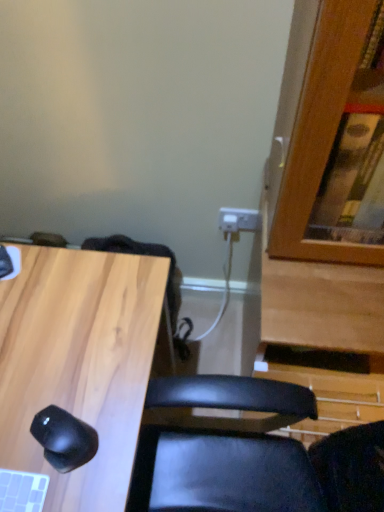
Find the location of a particular element. light wood/black mouse at lower left is located at coordinates (85, 369).

What do you see at coordinates (85, 369) in the screenshot?
I see `light wood/black mouse at lower left` at bounding box center [85, 369].

Describe the element at coordinates (64, 438) in the screenshot. The height and width of the screenshot is (512, 384). I see `black matte mouse at lower left` at that location.

Measure the distance between black matte mouse at lower left and camera.

black matte mouse at lower left and camera are 27.59 inches apart.

Where is `black matte mouse at lower left`? The height and width of the screenshot is (512, 384). black matte mouse at lower left is located at coordinates (64, 438).

Where is `light wood/black mouse at lower left`? The height and width of the screenshot is (512, 384). light wood/black mouse at lower left is located at coordinates (85, 369).

Based on their positions, is light wood/black mouse at lower left located to the left or right of black matte mouse at lower left?

light wood/black mouse at lower left is positioned on black matte mouse at lower left's left side.

Is light wood/black mouse at lower left in front of black matte mouse at lower left?

That is True.

Which is further, (102, 370) or (75, 432)?

The point (102, 370) is farther.

From the image's perspective, which is below, light wood/black mouse at lower left or black matte mouse at lower left?

From the image's view, light wood/black mouse at lower left is below.

Consider the image. From a real-world perspective, who is located higher, light wood/black mouse at lower left or black matte mouse at lower left?

black matte mouse at lower left is physically above.

Is light wood/black mouse at lower left wider than black matte mouse at lower left?

Yes.

Who is shorter, light wood/black mouse at lower left or black matte mouse at lower left?

black matte mouse at lower left is shorter.

Considering the sizes of light wood/black mouse at lower left and black matte mouse at lower left in the image, is light wood/black mouse at lower left bigger or smaller than black matte mouse at lower left?

light wood/black mouse at lower left is bigger than black matte mouse at lower left.

Would you say light wood/black mouse at lower left is inside or outside black matte mouse at lower left?

light wood/black mouse at lower left lies outside black matte mouse at lower left.

Would you consider light wood/black mouse at lower left to be distant from black matte mouse at lower left?

Actually, light wood/black mouse at lower left and black matte mouse at lower left are a little close together.

Is black matte mouse at lower left at the back of light wood/black mouse at lower left?

No, black matte mouse at lower left is not at the back of light wood/black mouse at lower left.

Based on the photo, can you tell me how much light wood/black mouse at lower left and black matte mouse at lower left differ in facing direction?

The facing directions of light wood/black mouse at lower left and black matte mouse at lower left are 23.2 degrees apart.

Based on the photo, how much distance is there between light wood/black mouse at lower left and black matte mouse at lower left?

The distance of light wood/black mouse at lower left from black matte mouse at lower left is 15.38 centimeters.

Where is `desk directly beneath the black matte mouse at lower left (from a real-world perspective)`? The width and height of the screenshot is (384, 512). desk directly beneath the black matte mouse at lower left (from a real-world perspective) is located at coordinates (85, 369).

In the image, is black matte mouse at lower left on the left side or the right side of light wood/black mouse at lower left?

black matte mouse at lower left is to the right of light wood/black mouse at lower left.

Is black matte mouse at lower left further to camera compared to light wood/black mouse at lower left?

Yes, it is behind light wood/black mouse at lower left.

Is point (65, 412) positioned before point (115, 268)?

Yes.

From the image's perspective, is black matte mouse at lower left located above light wood/black mouse at lower left?

Yes.

From a real-world perspective, is black matte mouse at lower left above or below light wood/black mouse at lower left?

From a real-world perspective, black matte mouse at lower left is physically above light wood/black mouse at lower left.

Considering the relative sizes of black matte mouse at lower left and light wood/black mouse at lower left in the image provided, is black matte mouse at lower left thinner than light wood/black mouse at lower left?

Indeed, black matte mouse at lower left has a lesser width compared to light wood/black mouse at lower left.

In terms of height, does black matte mouse at lower left look taller or shorter compared to light wood/black mouse at lower left?

Considering their sizes, black matte mouse at lower left has less height than light wood/black mouse at lower left.

Is black matte mouse at lower left bigger than light wood/black mouse at lower left?

No.

Is light wood/black mouse at lower left inside black matte mouse at lower left?

No, light wood/black mouse at lower left is not a part of black matte mouse at lower left.

Are black matte mouse at lower left and light wood/black mouse at lower left located far from each other?

That's not correct — black matte mouse at lower left is a little close to light wood/black mouse at lower left.

Consider the image. Is black matte mouse at lower left oriented away from light wood/black mouse at lower left?

black matte mouse at lower left does not have its back to light wood/black mouse at lower left.

The width and height of the screenshot is (384, 512). Identify the location of desk located on the left of black matte mouse at lower left. (85, 369).

Where is `desk on the left of black matte mouse at lower left`? The width and height of the screenshot is (384, 512). desk on the left of black matte mouse at lower left is located at coordinates (85, 369).

What are the coordinates of `desk in front of the black matte mouse at lower left` in the screenshot? It's located at [85, 369].